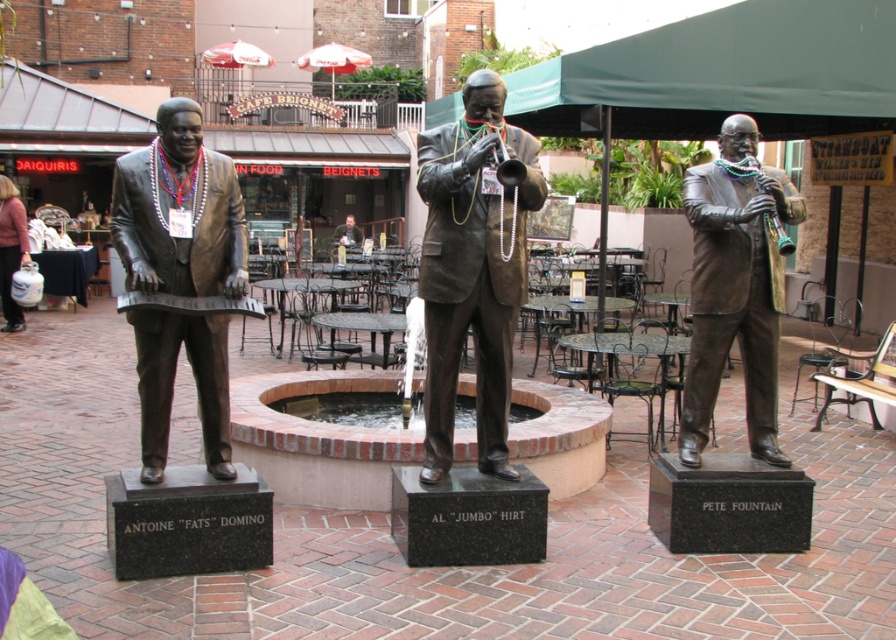
You are standing at the point marked by the coordinates (x=472, y=269) in the courtyard. What object are you directly at?

The point marked by the coordinates (x=472, y=269) is directly at the bronze statue at center.

You are a visitor standing at the entrance of the courtyard. You see the green fabric canopy at upper center and the bronze statue at center. Which object is directly above the other?

The green fabric canopy at upper center is positioned over the bronze statue at center, so the green fabric canopy is directly above the bronze statue.